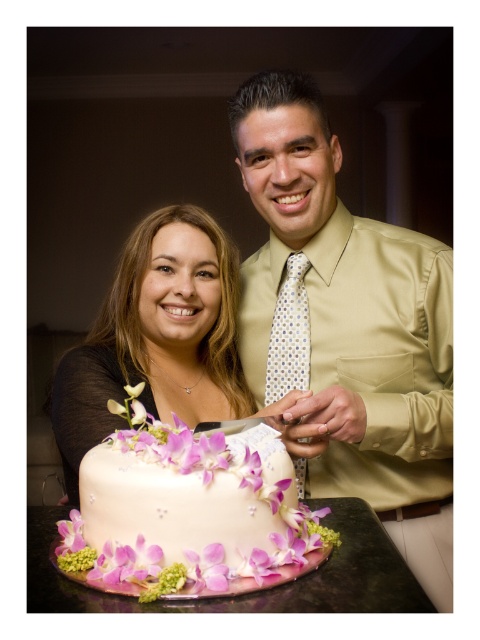
You are planning to serve both the white fondant cake with floral decorations at center and the smooth cream cake at center at a party. Which cake has a smaller width?

The white fondant cake with floral decorations at center has a lesser width compared to the smooth cream cake at center.